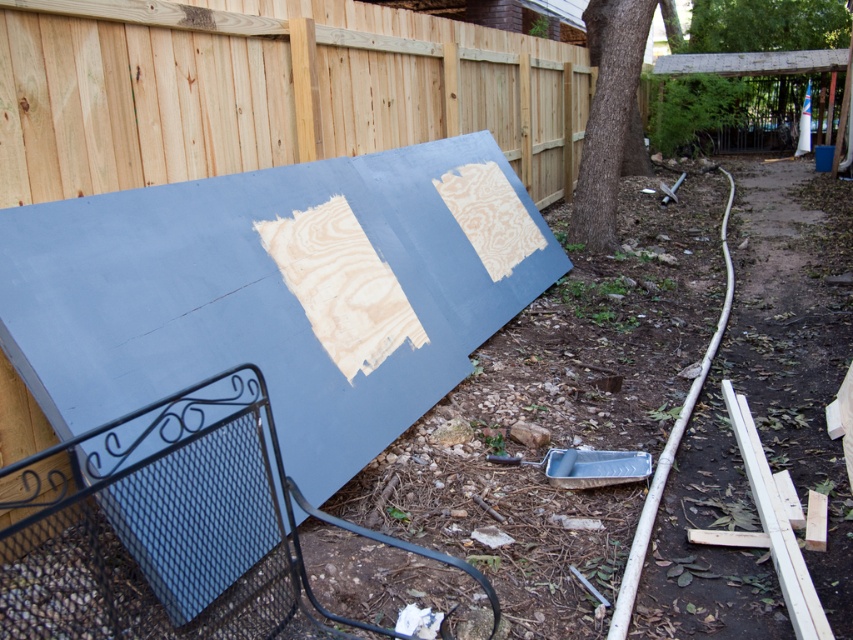
Question: Does brown rough bark tree at center appear on the right side of green wood tree at upper center?

Choices:
 (A) yes
 (B) no

Answer: (B)

Question: Which of the following is the farthest from the observer?

Choices:
 (A) (778, 29)
 (B) (587, 193)

Answer: (A)

Question: Among these points, which one is farthest from the camera?

Choices:
 (A) 592,180
 (B) 711,3

Answer: (B)

Question: Does brown rough bark tree at center have a smaller size compared to green wood tree at upper center?

Choices:
 (A) no
 (B) yes

Answer: (B)

Question: Is brown rough bark tree at center positioned before green wood tree at upper center?

Choices:
 (A) no
 (B) yes

Answer: (B)

Question: Which point appears closest to the camera in this image?

Choices:
 (A) (700, 70)
 (B) (576, 234)

Answer: (B)